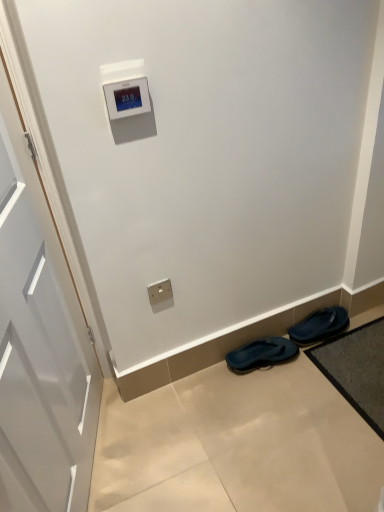
Question: From the image's perspective, is satin gold outlet at lower center on beige tile floor at lower center?

Choices:
 (A) no
 (B) yes

Answer: (B)

Question: Can you confirm if satin gold outlet at lower center is positioned to the left of beige tile floor at lower center?

Choices:
 (A) yes
 (B) no

Answer: (A)

Question: From a real-world perspective, does satin gold outlet at lower center stand above beige tile floor at lower center?

Choices:
 (A) yes
 (B) no

Answer: (A)

Question: Can you confirm if satin gold outlet at lower center is thinner than beige tile floor at lower center?

Choices:
 (A) yes
 (B) no

Answer: (A)

Question: Could you tell me if satin gold outlet at lower center is turned towards beige tile floor at lower center?

Choices:
 (A) yes
 (B) no

Answer: (B)

Question: Can you see satin gold outlet at lower center touching beige tile floor at lower center?

Choices:
 (A) yes
 (B) no

Answer: (B)

Question: Is dark gray textured bath mat at lower right closer to camera compared to black rubber slippers at lower right, placed as the 2th footwear when sorted from left to right?

Choices:
 (A) no
 (B) yes

Answer: (B)

Question: From the image's perspective, is dark gray textured bath mat at lower right above black rubber slippers at lower right, the first footwear when ordered from right to left?

Choices:
 (A) yes
 (B) no

Answer: (B)

Question: Does dark gray textured bath mat at lower right have a lesser height compared to black rubber slippers at lower right, the first footwear when ordered from right to left?

Choices:
 (A) yes
 (B) no

Answer: (A)

Question: Is dark gray textured bath mat at lower right at the left side of black rubber slippers at lower right, the first footwear when ordered from right to left?

Choices:
 (A) no
 (B) yes

Answer: (A)

Question: Is black rubber slippers at lower right, the first footwear when ordered from right to left, at the back of dark gray textured bath mat at lower right?

Choices:
 (A) yes
 (B) no

Answer: (B)

Question: From a real-world perspective, is dark gray textured bath mat at lower right positioned under black rubber slippers at lower right, the first footwear when ordered from right to left, based on gravity?

Choices:
 (A) no
 (B) yes

Answer: (B)

Question: Is dark blue rubber flip-flops at lower right, the second footwear from the right, behind satin gold outlet at lower center?

Choices:
 (A) yes
 (B) no

Answer: (A)